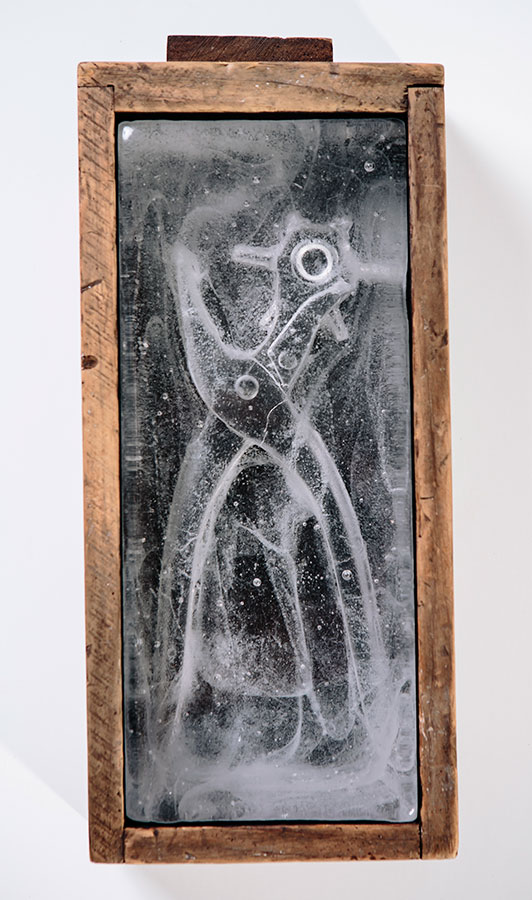
Identify the location of rectangle wooden frame. Image resolution: width=532 pixels, height=900 pixels. point(101,469).